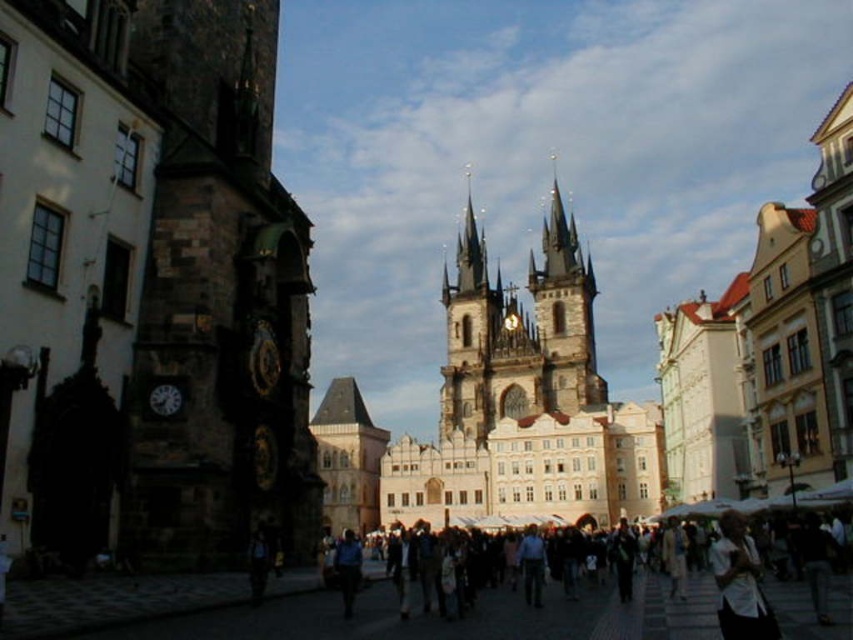
Based on the photo, you are a photographer standing in the square and want to capture both the white matte shirt at lower right and the blue fabric shirt at center in the same frame. Given that your camera has a 50mm lens, which has a field of view that can capture objects up to 60 feet apart, will you be able to include both shirts in your photo?

The white matte shirt at lower right and blue fabric shirt at center are 64.41 feet apart from each other. Since the camera lens can only capture up to 60 feet, the distance between them exceeds the field of view. Therefore, you won cannot include both shirts in the same frame with the current lens.

You are standing in the square and want to take a photo of the brown stone church at center. If you are currently 111.14 meters away from it, is this distance suitable for capturing the entire church in one frame?

The brown stone church at center is 111.14 meters away from the camera, so at this distance, the entire church can likely be captured in one frame as the distance matches the required field of view.

You are a tourist standing in the square and want to take a photo of the brown stone church at center without the white matte shirt at lower right blocking the view. Based on their sizes, is it possible to frame the shot so the church is fully visible while the shirt is out of frame?

The brown stone church at center is larger than the white matte shirt at lower right, so it might be possible to frame the shot so the church is fully visible while keeping the shirt out of the frame by adjusting the camera angle or zoom.